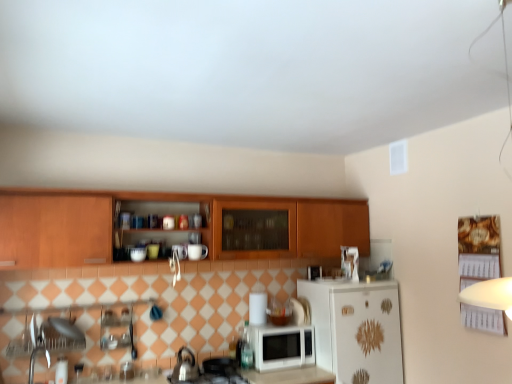
Question: Would you consider brushed metal tea pot at lower center to be distant from white matte refrigerator at lower right?

Choices:
 (A) no
 (B) yes

Answer: (B)

Question: Does brushed metal tea pot at lower center have a lesser height compared to white matte refrigerator at lower right?

Choices:
 (A) yes
 (B) no

Answer: (A)

Question: Can you confirm if brushed metal tea pot at lower center is wider than white matte refrigerator at lower right?

Choices:
 (A) yes
 (B) no

Answer: (B)

Question: Is brushed metal tea pot at lower center at the left side of white matte refrigerator at lower right?

Choices:
 (A) yes
 (B) no

Answer: (A)

Question: Is brushed metal tea pot at lower center turned away from white matte refrigerator at lower right?

Choices:
 (A) yes
 (B) no

Answer: (B)

Question: Is white matte refrigerator at lower right bigger or smaller than white matte microwave at center?

Choices:
 (A) small
 (B) big

Answer: (B)

Question: From a real-world perspective, is white matte refrigerator at lower right positioned above or below white matte microwave at center?

Choices:
 (A) above
 (B) below

Answer: (A)

Question: From the image's perspective, is white matte refrigerator at lower right positioned above or below white matte microwave at center?

Choices:
 (A) above
 (B) below

Answer: (A)

Question: Considering the positions of white matte refrigerator at lower right and white matte microwave at center in the image, is white matte refrigerator at lower right wider or thinner than white matte microwave at center?

Choices:
 (A) thin
 (B) wide

Answer: (B)

Question: Is white matte microwave at center to the left or to the right of wooden cabinets at center in the image?

Choices:
 (A) right
 (B) left

Answer: (A)

Question: Considering the positions of white matte microwave at center and wooden cabinets at center in the image, is white matte microwave at center bigger or smaller than wooden cabinets at center?

Choices:
 (A) big
 (B) small

Answer: (B)

Question: From the image's perspective, relative to wooden cabinets at center, is white matte microwave at center above or below?

Choices:
 (A) above
 (B) below

Answer: (B)

Question: Considering the positions of white matte microwave at center and wooden cabinets at center in the image, is white matte microwave at center wider or thinner than wooden cabinets at center?

Choices:
 (A) wide
 (B) thin

Answer: (B)

Question: In terms of size, does white glossy microwave at center appear bigger or smaller than wooden cabinets at center?

Choices:
 (A) big
 (B) small

Answer: (B)

Question: Considering the positions of white glossy microwave at center and wooden cabinets at center in the image, is white glossy microwave at center wider or thinner than wooden cabinets at center?

Choices:
 (A) thin
 (B) wide

Answer: (A)